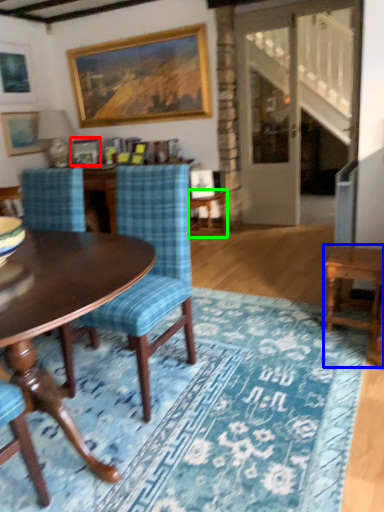
Question: Which object is positioned closest to picture frame (highlighted by a red box)? Select from table (highlighted by a blue box) and side table (highlighted by a green box).

Choices:
 (A) table
 (B) side table

Answer: (B)